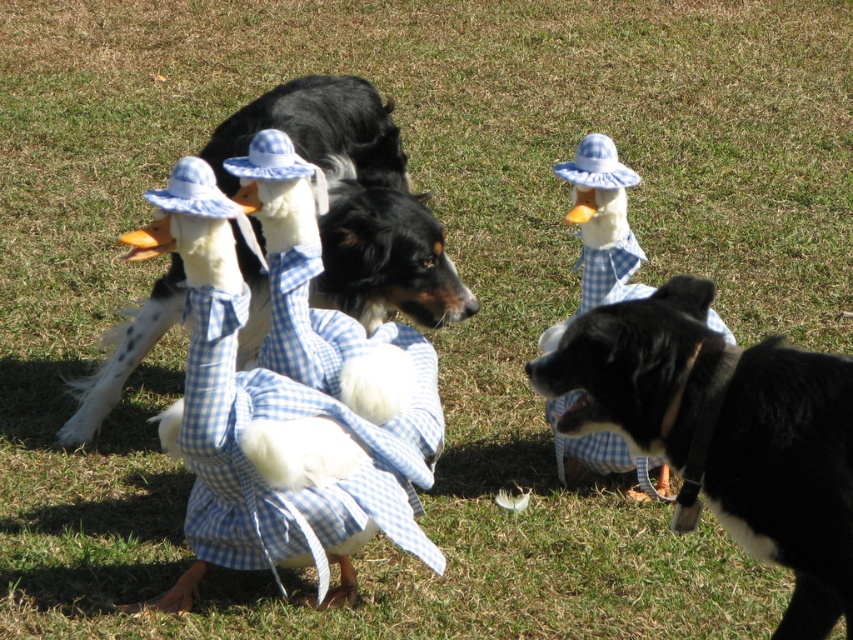
You are a photographer trying to capture a photo of both the blue checkered dress at center and the blue gingham duck at center. Which one should you focus on first if you want to ensure both are in the frame?

The blue checkered dress at center is taller than the blue gingham duck at center, so you should focus on the blue checkered dress at center first to ensure both are in the frame.